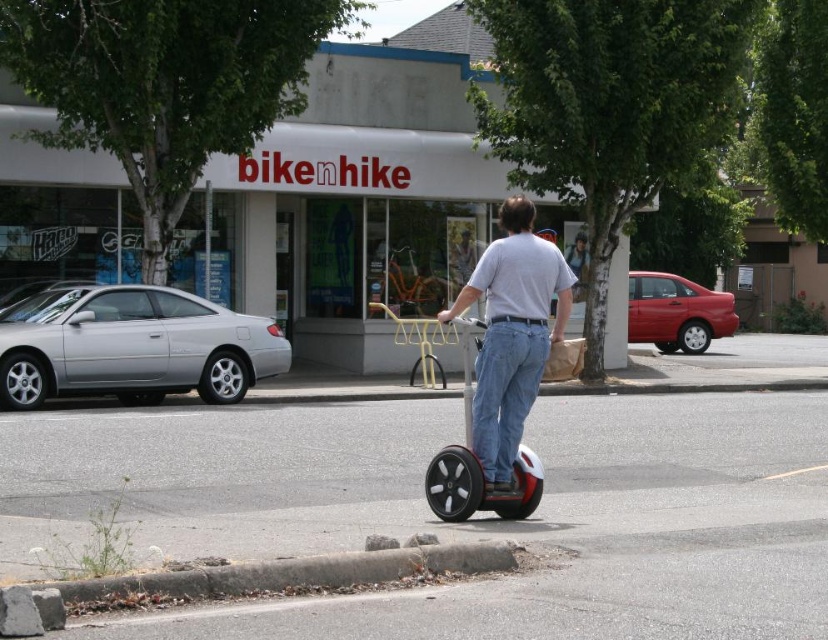
Between white matte storefront at center and red glossy scooter at center, which one appears on the left side from the viewer's perspective?

Positioned to the left is white matte storefront at center.

Does white matte storefront at center appear on the right side of red glossy scooter at center?

In fact, white matte storefront at center is to the left of red glossy scooter at center.

Image resolution: width=828 pixels, height=640 pixels. Describe the element at coordinates (345, 188) in the screenshot. I see `white matte storefront at center` at that location.

The width and height of the screenshot is (828, 640). In order to click on white matte storefront at center in this screenshot , I will do `click(345, 188)`.

Which is more to the left, white matte storefront at center or white matte segway at center?

Positioned to the left is white matte storefront at center.

Which is below, white matte storefront at center or white matte segway at center?

Positioned lower is white matte segway at center.

Locate an element on the screen. This screenshot has height=640, width=828. white matte storefront at center is located at coordinates (345, 188).

This screenshot has height=640, width=828. Find the location of `white matte storefront at center`. white matte storefront at center is located at coordinates (345, 188).

How far apart are white matte segway at center and red glossy scooter at center?

white matte segway at center is 82.39 centimeters from red glossy scooter at center.

Can you confirm if white matte segway at center is positioned below red glossy scooter at center?

Actually, white matte segway at center is above red glossy scooter at center.

Is point (566, 314) in front of point (485, 499)?

No, it is behind (485, 499).

Image resolution: width=828 pixels, height=640 pixels. I want to click on white matte segway at center, so click(x=513, y=333).